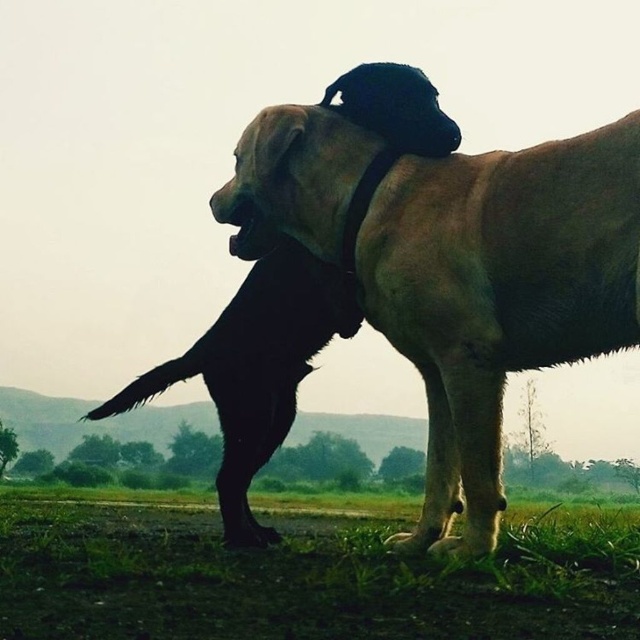
Question: Does light brown fur at center appear over light brown fur dog at center?

Choices:
 (A) yes
 (B) no

Answer: (A)

Question: Which of the following is the farthest from the observer?

Choices:
 (A) black leather neckband at upper center
 (B) light brown fur at center
 (C) fuzzy beige paw at lower center

Answer: (A)

Question: Is light brown fur dog at center closer to camera compared to black fur paw at lower center?

Choices:
 (A) no
 (B) yes

Answer: (A)

Question: Among these points, which one is farthest from the camera?

Choices:
 (A) (342, 232)
 (B) (225, 529)
 (C) (298, 588)

Answer: (B)

Question: Which point is farther from the camera taking this photo?

Choices:
 (A) (378, 154)
 (B) (406, 550)
 (C) (257, 528)
 (D) (403, 212)

Answer: (C)

Question: Is black leather neckband at upper center positioned at the back of fuzzy beige paw at lower center?

Choices:
 (A) yes
 (B) no

Answer: (A)